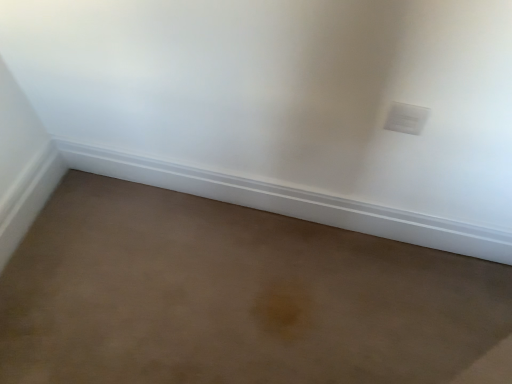
Question: Should I look upward or downward to see white plastic electric outlet at upper right?

Choices:
 (A) up
 (B) down

Answer: (A)